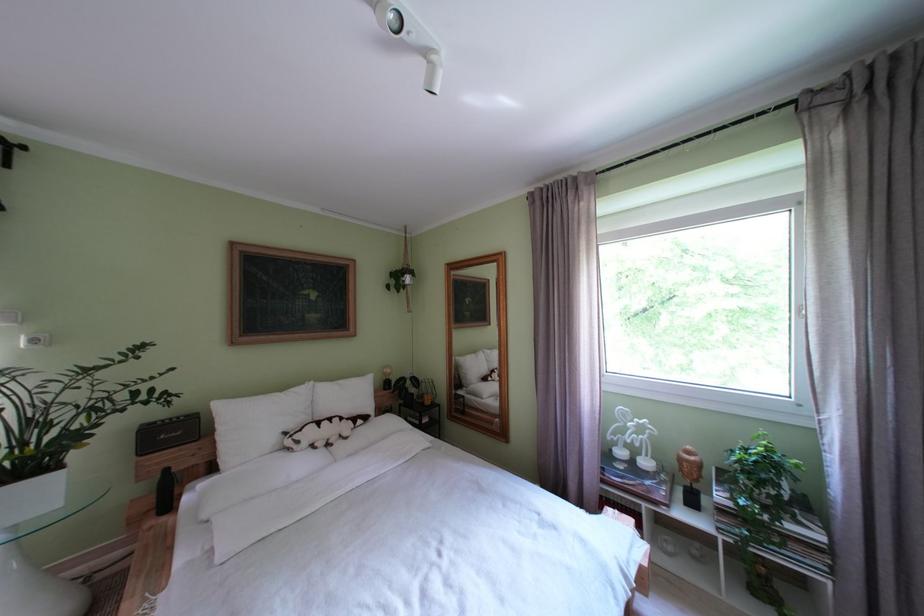
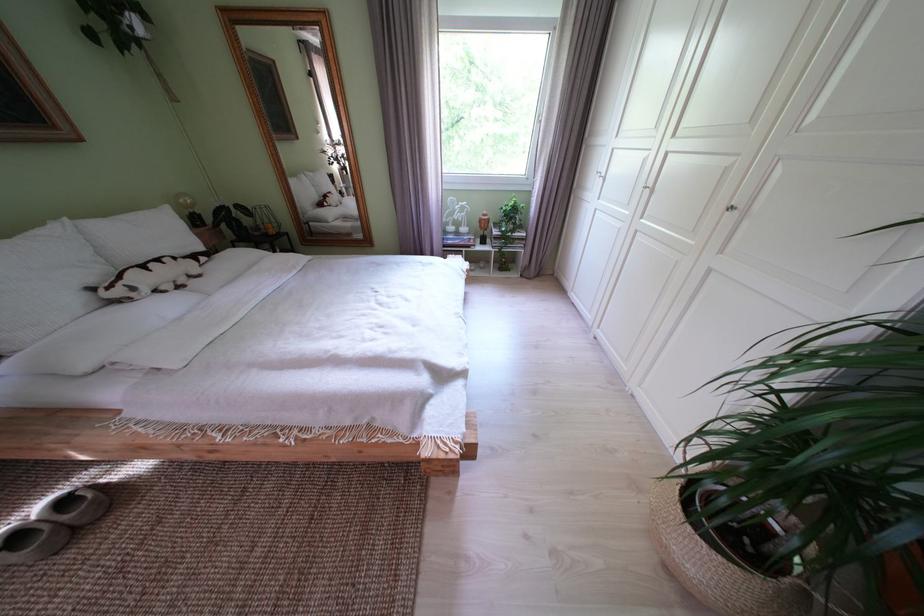
The point at (597,466) is marked in the first image. Where is the corresponding point in the second image?

(445, 241)